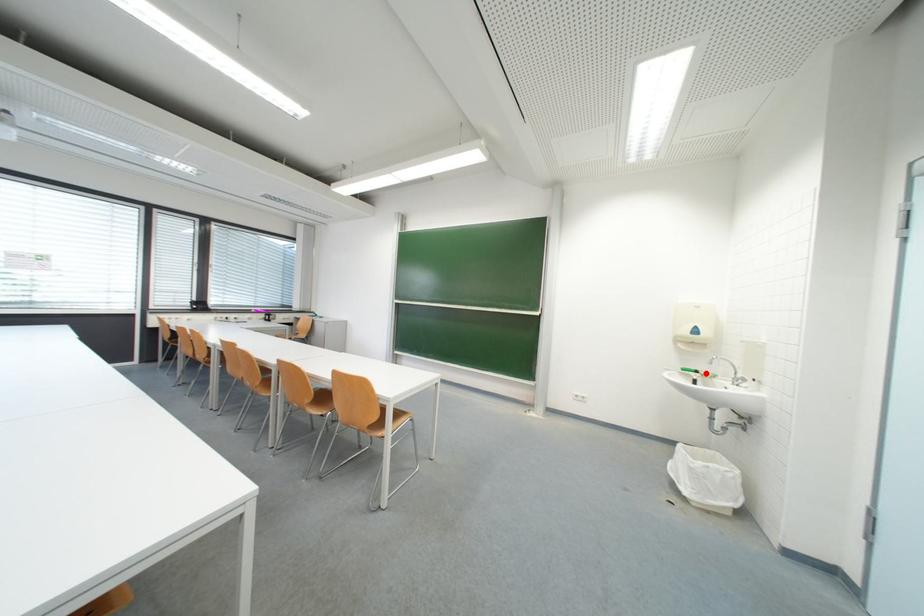
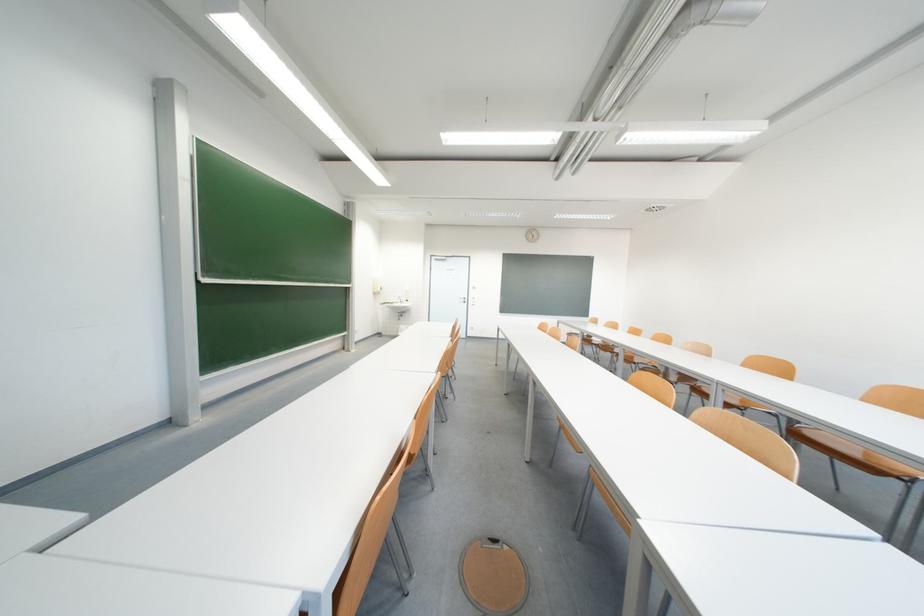
Question: I am providing you with two images of the same scene from different viewpoints. A red point is marked on the first image. At the location where the point appears in image 1, is it still visible in image 2?

Choices:
 (A) Yes
 (B) No

Answer: (B)